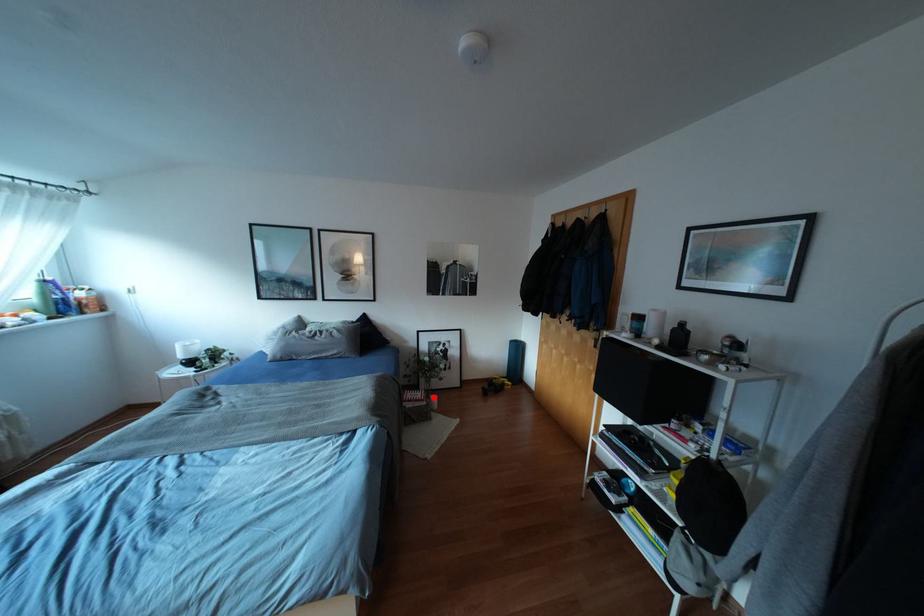
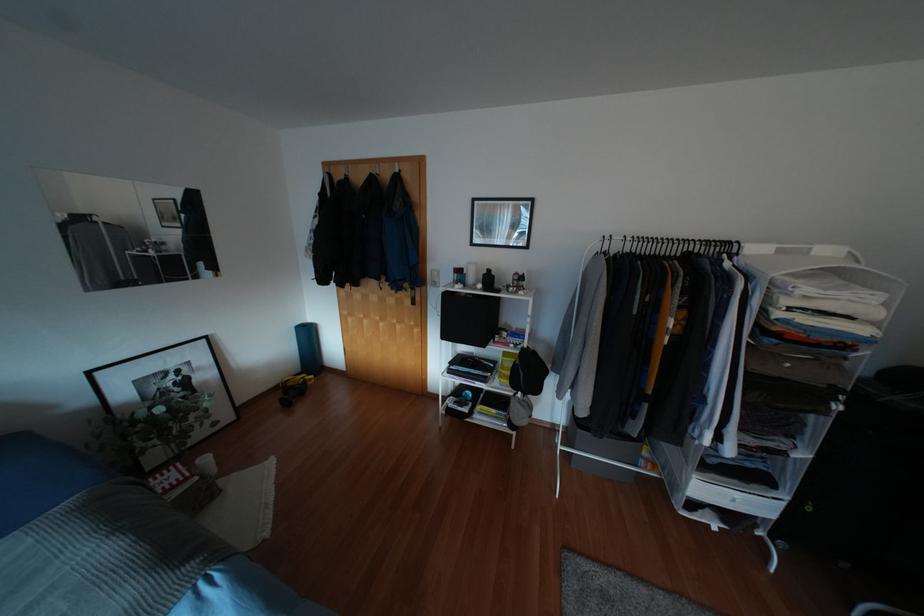
Question: I am providing you with two images of the same scene from different viewpoints. A red point is shown in image1. For the corresponding object point in image2, is it positioned nearer or farther from the camera?

Choices:
 (A) Nearer
 (B) Farther

Answer: (A)